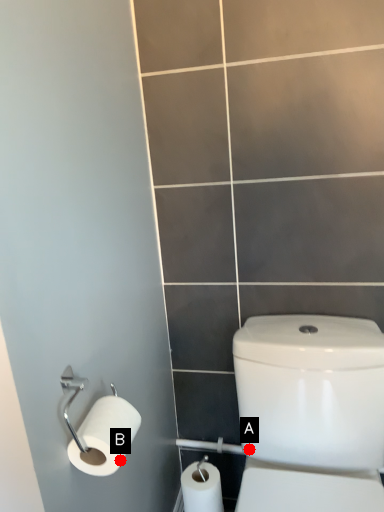
Question: Two points are circled on the image, labeled by A and B beside each circle. Which point is closer to the camera taking this photo?

Choices:
 (A) A is closer
 (B) B is closer

Answer: (B)